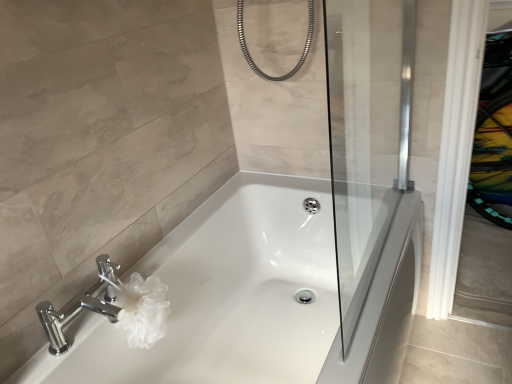
Question: Considering the relative sizes of chrome/metallic faucet at lower left and white glossy bathtub at center in the image provided, is chrome/metallic faucet at lower left smaller than white glossy bathtub at center?

Choices:
 (A) yes
 (B) no

Answer: (A)

Question: Can you confirm if chrome/metallic faucet at lower left is shorter than white glossy bathtub at center?

Choices:
 (A) no
 (B) yes

Answer: (B)

Question: Considering the relative sizes of chrome/metallic faucet at lower left and white glossy bathtub at center in the image provided, is chrome/metallic faucet at lower left thinner than white glossy bathtub at center?

Choices:
 (A) no
 (B) yes

Answer: (B)

Question: Is chrome/metallic faucet at lower left not close to white glossy bathtub at center?

Choices:
 (A) no
 (B) yes

Answer: (A)

Question: From a real-world perspective, is chrome/metallic faucet at lower left over white glossy bathtub at center?

Choices:
 (A) no
 (B) yes

Answer: (B)

Question: Is point (337, 104) closer or farther from the camera than point (117, 317)?

Choices:
 (A) farther
 (B) closer

Answer: (A)

Question: In terms of size, does transparent glass screen door at center appear bigger or smaller than chrome/metallic faucet at lower left?

Choices:
 (A) small
 (B) big

Answer: (B)

Question: Visually, is transparent glass screen door at center positioned to the left or to the right of chrome/metallic faucet at lower left?

Choices:
 (A) left
 (B) right

Answer: (B)

Question: Considering their positions, is transparent glass screen door at center located in front of or behind chrome/metallic faucet at lower left?

Choices:
 (A) front
 (B) behind

Answer: (A)

Question: From the image's perspective, is chrome/metallic faucet at lower left located above or below transparent glass screen door at center?

Choices:
 (A) above
 (B) below

Answer: (B)

Question: Based on their sizes in the image, would you say chrome/metallic faucet at lower left is bigger or smaller than transparent glass screen door at center?

Choices:
 (A) small
 (B) big

Answer: (A)

Question: Is chrome/metallic faucet at lower left wider or thinner than transparent glass screen door at center?

Choices:
 (A) thin
 (B) wide

Answer: (B)

Question: In the image, is chrome/metallic faucet at lower left positioned in front of or behind transparent glass screen door at center?

Choices:
 (A) behind
 (B) front

Answer: (A)

Question: Does point (401, 46) appear closer or farther from the camera than point (239, 331)?

Choices:
 (A) closer
 (B) farther

Answer: (A)

Question: Is transparent glass screen door at center situated inside white glossy bathtub at center or outside?

Choices:
 (A) inside
 (B) outside

Answer: (B)